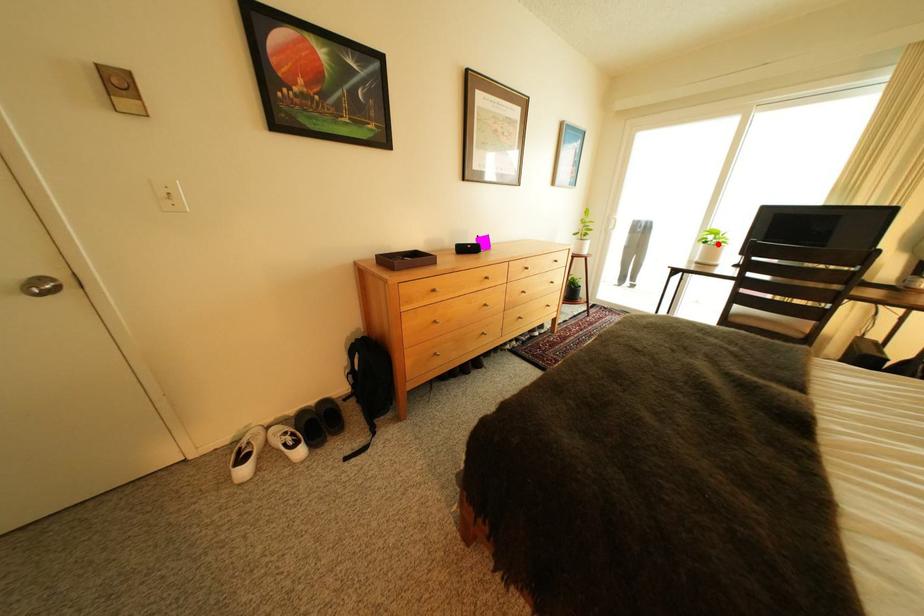
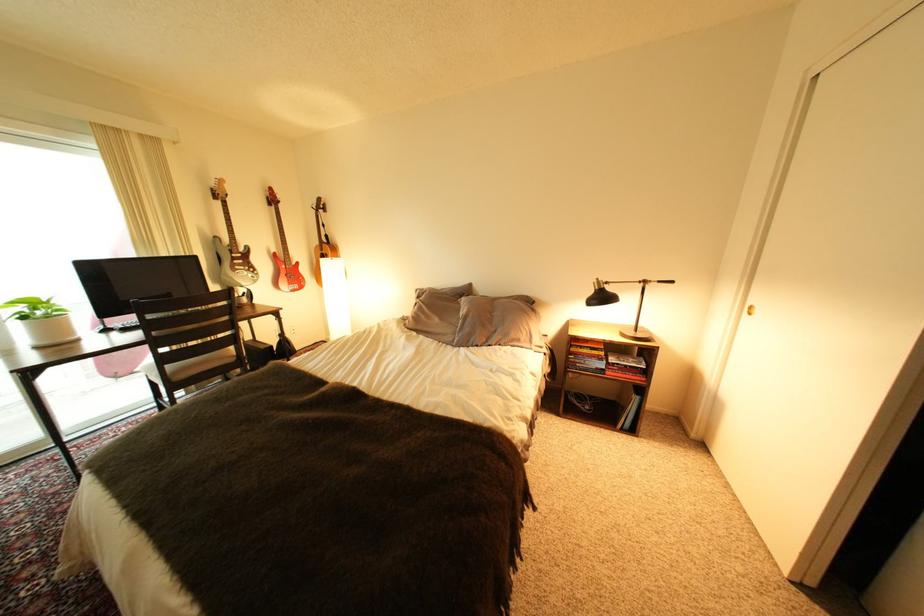
In the second image, find the point that corresponds to the highlighted location in the first image.

(37, 318)